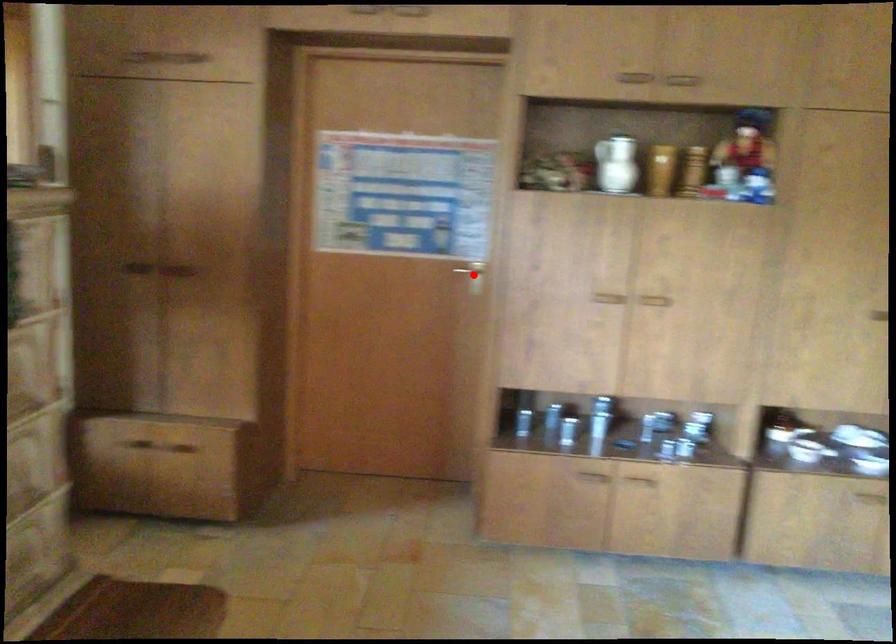
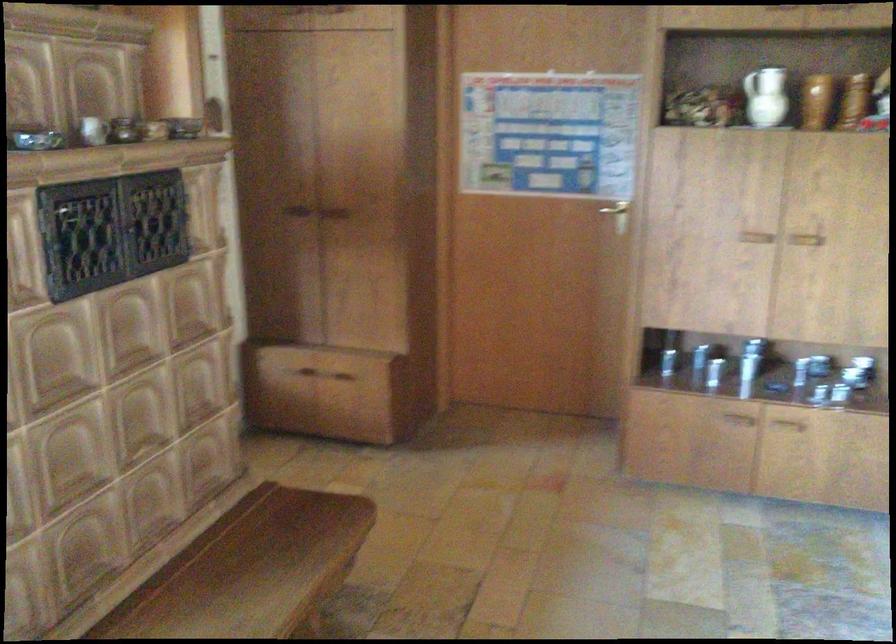
Where in the second image is the point corresponding to the highlighted location from the first image?

(616, 214)